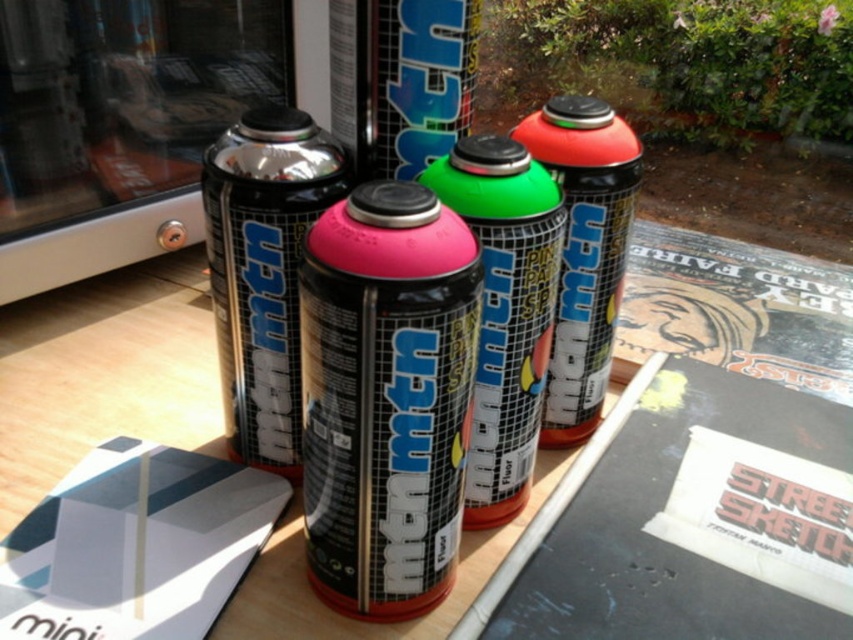
Question: Which point is farther to the camera?

Choices:
 (A) (515, 160)
 (B) (601, 227)
 (C) (390, 243)

Answer: (B)

Question: Among these points, which one is farthest from the camera?

Choices:
 (A) (276, 275)
 (B) (556, 227)

Answer: (A)

Question: Among these objects, which one is farthest from the camera?

Choices:
 (A) metallic black spray can at center
 (B) green matte spray can at center

Answer: (A)

Question: Is pink matte spray can at center below green matte spray can at center?

Choices:
 (A) yes
 (B) no

Answer: (A)

Question: Is green matte spray can at center positioned at the back of matte black spray can at center?

Choices:
 (A) no
 (B) yes

Answer: (A)

Question: Does metallic black spray can at center appear on the left side of green matte spray can at center?

Choices:
 (A) yes
 (B) no

Answer: (A)